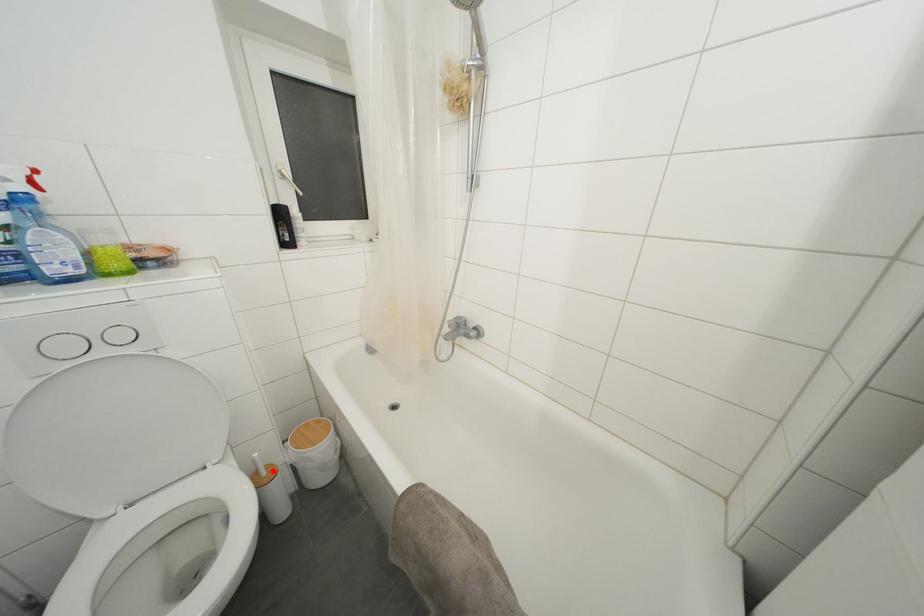
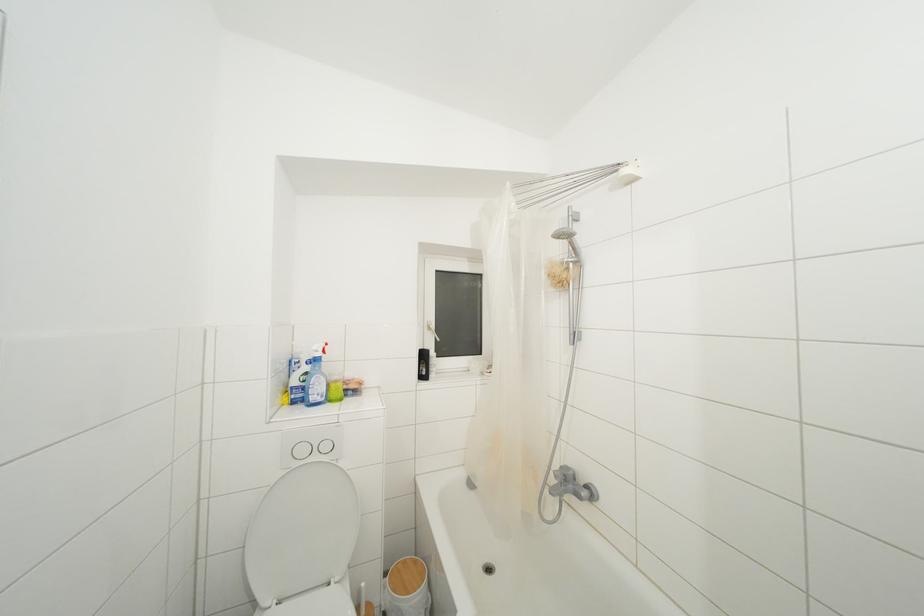
The point at the highlighted location is marked in the first image. Where is the corresponding point in the second image?

(371, 610)